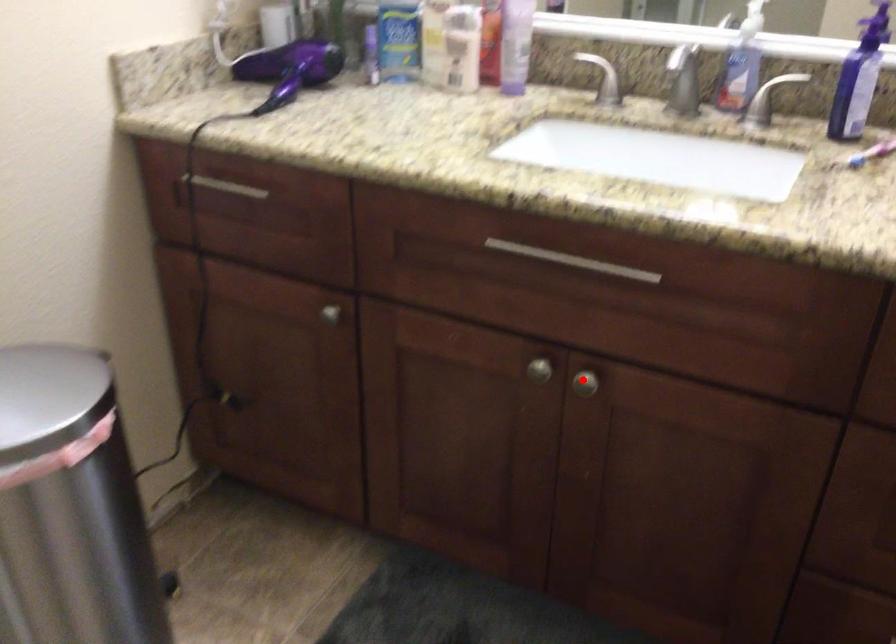
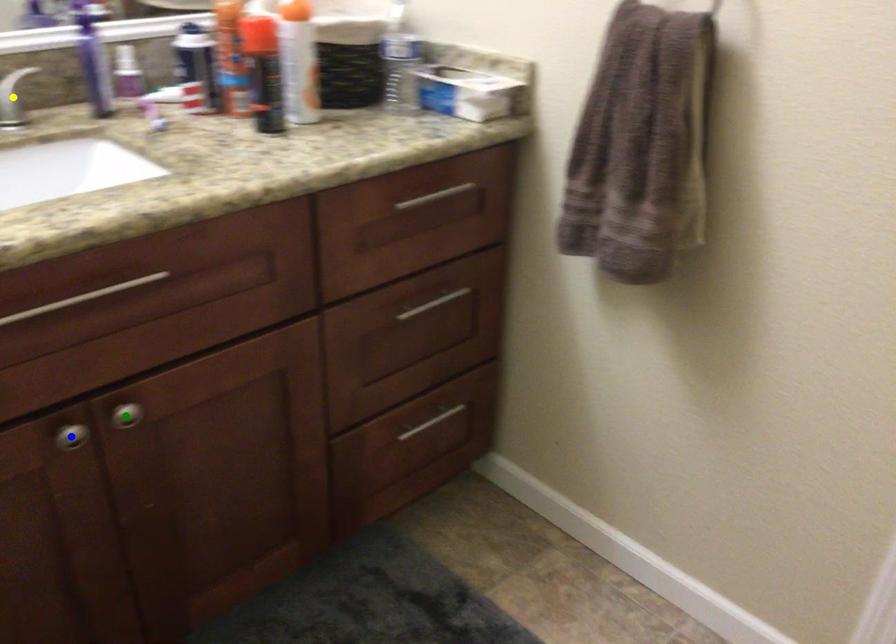
Question: I am providing you with two images of the same scene from different viewpoints. A red point is marked on the first image. You are given multiple points on the second image. In image 2, which mark is for the same physical point as the one in image 1?

Choices:
 (A) blue point
 (B) yellow point
 (C) green point

Answer: (C)